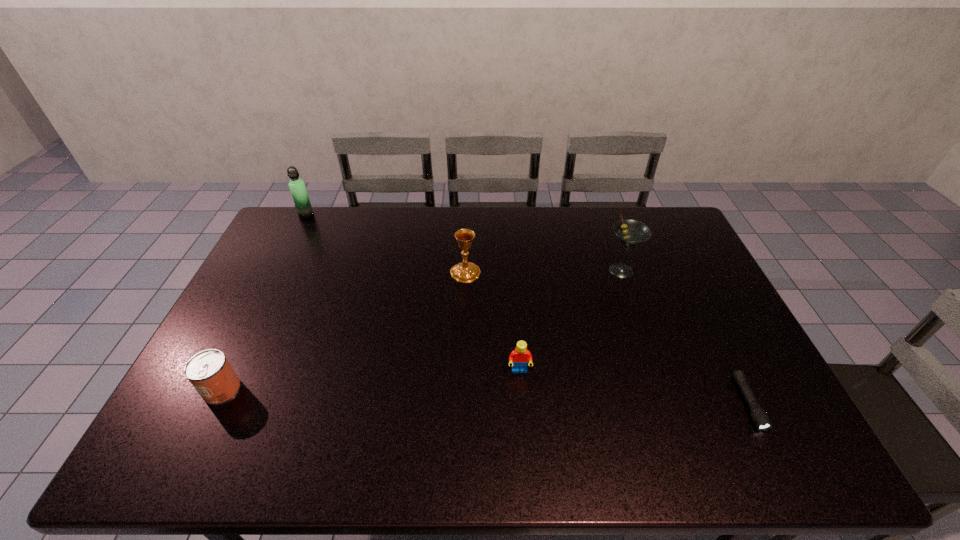
Image resolution: width=960 pixels, height=540 pixels. I want to click on the farthest object, so click(297, 187).

Locate an element on the screen. The height and width of the screenshot is (540, 960). the fifth object from left to right is located at coordinates (631, 233).

Locate an element on the screen. This screenshot has width=960, height=540. the third object from left to right is located at coordinates pyautogui.click(x=465, y=272).

Locate an element on the screen. the third tallest object is located at coordinates (465, 272).

You are a GUI agent. You are given a task and a screenshot of the screen. Output one action in this format:
    pyautogui.click(x=<x>, y=<y>)
    Task: Click on the Lego
    
    Given the screenshot: What is the action you would take?
    520,356

The width and height of the screenshot is (960, 540). I want to click on can, so click(x=209, y=371).

Identify the location of flashlight. (760, 418).

Identify the location of the rightmost object. Image resolution: width=960 pixels, height=540 pixels. (760, 418).

Identify the location of vacant point located on the right of the farthest object. (385, 215).

The width and height of the screenshot is (960, 540). Identify the location of vacant area situated 0.220m on the front of the second object from right to left. (643, 335).